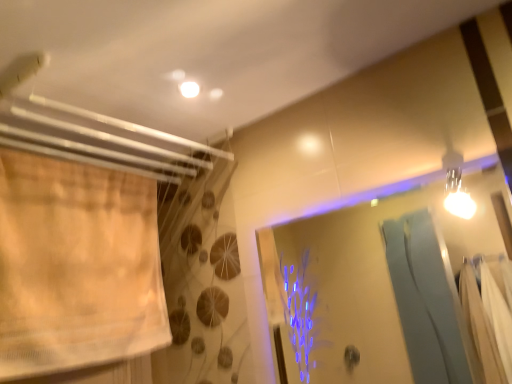
Find the location of a particular element. The height and width of the screenshot is (384, 512). transparent glass screen door at upper right is located at coordinates (386, 286).

Describe the element at coordinates (386, 286) in the screenshot. I see `transparent glass screen door at upper right` at that location.

What is the approximate height of transparent glass screen door at upper right?

transparent glass screen door at upper right is 21.14 inches in height.

This screenshot has width=512, height=384. Describe the element at coordinates (76, 266) in the screenshot. I see `beige sheer curtain at left` at that location.

Where is `beige sheer curtain at left`? This screenshot has width=512, height=384. beige sheer curtain at left is located at coordinates (76, 266).

Identify the location of transparent glass screen door at upper right. The width and height of the screenshot is (512, 384). (386, 286).

Which is more to the right, beige sheer curtain at left or transparent glass screen door at upper right?

transparent glass screen door at upper right is more to the right.

Is beige sheer curtain at left further to the viewer compared to transparent glass screen door at upper right?

Yes.

Is point (90, 168) in front of point (362, 329)?

Yes, it is.

From the image's perspective, relative to transparent glass screen door at upper right, is beige sheer curtain at left above or below?

Clearly, from the image's perspective, beige sheer curtain at left is above transparent glass screen door at upper right.

From a real-world perspective, does beige sheer curtain at left sit lower than transparent glass screen door at upper right?

No, from a real-world perspective, beige sheer curtain at left is not beneath transparent glass screen door at upper right.

Is beige sheer curtain at left wider than transparent glass screen door at upper right?

Correct, the width of beige sheer curtain at left exceeds that of transparent glass screen door at upper right.

Which of these two, beige sheer curtain at left or transparent glass screen door at upper right, stands shorter?

Standing shorter between the two is transparent glass screen door at upper right.

Can you confirm if beige sheer curtain at left is bigger than transparent glass screen door at upper right?

Indeed, beige sheer curtain at left has a larger size compared to transparent glass screen door at upper right.

Is beige sheer curtain at left positioned beyond the bounds of transparent glass screen door at upper right?

Indeed, beige sheer curtain at left is completely outside transparent glass screen door at upper right.

Would you consider beige sheer curtain at left to be distant from transparent glass screen door at upper right?

Yes, beige sheer curtain at left is far from transparent glass screen door at upper right.

Is transparent glass screen door at upper right at the back of beige sheer curtain at left?

beige sheer curtain at left is not turned away from transparent glass screen door at upper right.

How distant is beige sheer curtain at left from transparent glass screen door at upper right?

They are 5.05 feet apart.

Locate an element on the screen. Image resolution: width=512 pixels, height=384 pixels. screen door on the right of beige sheer curtain at left is located at coordinates (386, 286).

Is transparent glass screen door at upper right to the left of beige sheer curtain at left from the viewer's perspective?

In fact, transparent glass screen door at upper right is to the right of beige sheer curtain at left.

Between transparent glass screen door at upper right and beige sheer curtain at left, which one is positioned behind?

beige sheer curtain at left is behind.

Which point is more forward, [319,292] or [61,355]?

Positioned in front is point [61,355].

From the image's perspective, is transparent glass screen door at upper right under beige sheer curtain at left?

Yes, from the image's perspective, transparent glass screen door at upper right is beneath beige sheer curtain at left.

From a real-world perspective, is transparent glass screen door at upper right located beneath beige sheer curtain at left?

Indeed, from a real-world perspective, transparent glass screen door at upper right is positioned beneath beige sheer curtain at left.

Does transparent glass screen door at upper right have a lesser width compared to beige sheer curtain at left?

Yes.

Considering the relative sizes of transparent glass screen door at upper right and beige sheer curtain at left in the image provided, is transparent glass screen door at upper right shorter than beige sheer curtain at left?

Yes, transparent glass screen door at upper right is shorter than beige sheer curtain at left.

Looking at the image, does transparent glass screen door at upper right seem bigger or smaller compared to beige sheer curtain at left?

transparent glass screen door at upper right is smaller than beige sheer curtain at left.

Choose the correct answer: Is transparent glass screen door at upper right inside beige sheer curtain at left or outside it?

transparent glass screen door at upper right is located beyond the bounds of beige sheer curtain at left.

Is transparent glass screen door at upper right beside beige sheer curtain at left?

transparent glass screen door at upper right and beige sheer curtain at left are not in contact.

From the picture: Does transparent glass screen door at upper right turn towards beige sheer curtain at left?

No, transparent glass screen door at upper right is not aimed at beige sheer curtain at left.

Can you tell me how much transparent glass screen door at upper right and beige sheer curtain at left differ in facing direction?

They differ by 90 degrees in their facing directions.

Locate an element on the screen. The width and height of the screenshot is (512, 384). screen door below the beige sheer curtain at left (from the image's perspective) is located at coordinates (386, 286).

Identify the location of screen door on the right of the beige sheer curtain at left. (386, 286).

This screenshot has width=512, height=384. I want to click on curtain above the transparent glass screen door at upper right (from a real-world perspective), so click(x=76, y=266).